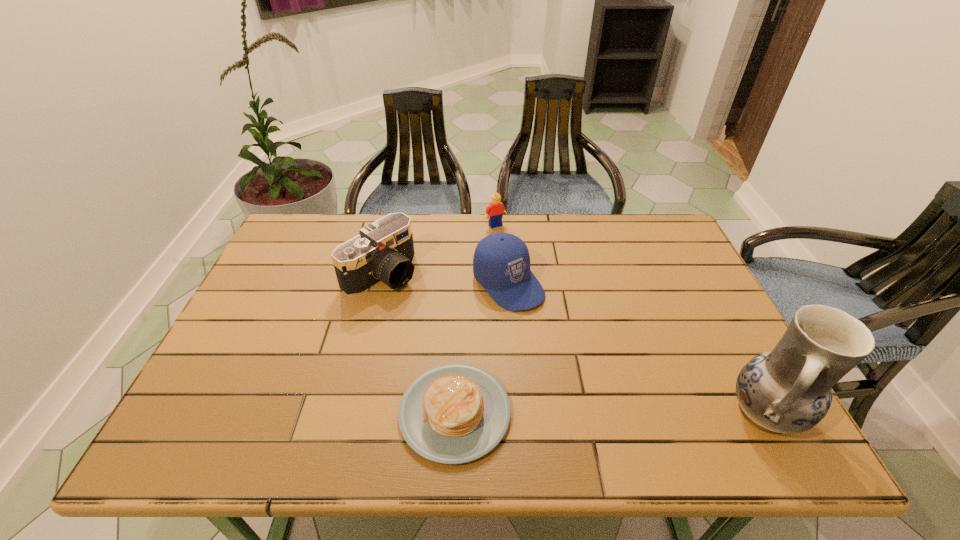
Image resolution: width=960 pixels, height=540 pixels. In order to click on pancake located in the near edge section of the desktop in this screenshot , I will do `click(456, 413)`.

I want to click on pottery present at the near edge, so click(x=788, y=390).

The width and height of the screenshot is (960, 540). Identify the location of object located at the right edge. (788, 390).

Locate an element on the screen. Image resolution: width=960 pixels, height=540 pixels. object at the near right corner is located at coordinates (788, 390).

Locate an element on the screen. Image resolution: width=960 pixels, height=540 pixels. vacant space at the far edge of the desktop is located at coordinates (593, 238).

The width and height of the screenshot is (960, 540). Identify the location of vacant space at the near edge of the desktop. (656, 390).

Where is `vacant space at the left edge of the desktop`? Image resolution: width=960 pixels, height=540 pixels. vacant space at the left edge of the desktop is located at coordinates (305, 289).

Find the location of a particular element. This screenshot has height=540, width=960. free space at the right edge of the desktop is located at coordinates (687, 353).

Image resolution: width=960 pixels, height=540 pixels. I want to click on vacant space at the far left corner of the desktop, so click(x=300, y=254).

Find the location of `vacant space at the near left corner of the desktop`. vacant space at the near left corner of the desktop is located at coordinates (256, 397).